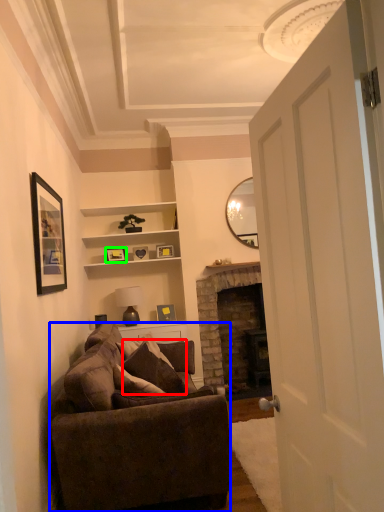
Question: Considering the real-world distances, which object is farthest from pillow (highlighted by a red box)? studio couch (highlighted by a blue box) or picture frame (highlighted by a green box)?

Choices:
 (A) studio couch
 (B) picture frame

Answer: (B)